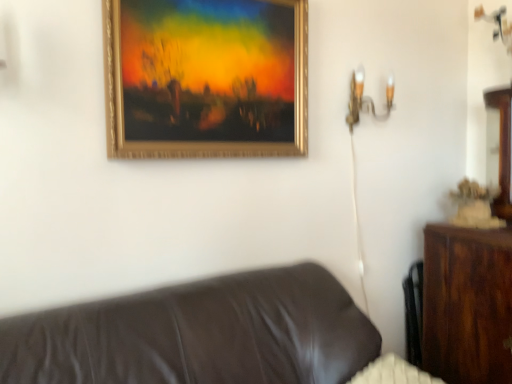
The height and width of the screenshot is (384, 512). I want to click on gold metallic picture frame at upper center, so click(206, 78).

Image resolution: width=512 pixels, height=384 pixels. Describe the element at coordinates (206, 78) in the screenshot. I see `gold metallic picture frame at upper center` at that location.

This screenshot has height=384, width=512. I want to click on brown leather couch at lower left, so click(x=199, y=334).

Is brown leather couch at lower left far from gold metallic picture frame at upper center?

No, brown leather couch at lower left is not far away from gold metallic picture frame at upper center.

How different are the orientations of brown leather couch at lower left and gold metallic picture frame at upper center in degrees?

0.402 degrees separate the facing orientations of brown leather couch at lower left and gold metallic picture frame at upper center.

Who is bigger, brown leather couch at lower left or gold metallic picture frame at upper center?

brown leather couch at lower left.

Which object is further away from the camera, brown leather couch at lower left or gold metallic picture frame at upper center?

gold metallic picture frame at upper center is further from the camera.

From the image's perspective, which one is positioned higher, gold metallic wall sconce at upper right or gold metallic picture frame at upper center?

gold metallic picture frame at upper center, from the image's perspective.

From a real-world perspective, is gold metallic wall sconce at upper right located higher than gold metallic picture frame at upper center?

Actually, gold metallic wall sconce at upper right is physically below gold metallic picture frame at upper center in the real world.

Can you confirm if gold metallic wall sconce at upper right is positioned to the left of gold metallic picture frame at upper center?

No, gold metallic wall sconce at upper right is not to the left of gold metallic picture frame at upper center.

Is gold metallic wall sconce at upper right touching gold metallic picture frame at upper center?

No, gold metallic wall sconce at upper right is not with gold metallic picture frame at upper center.

Considering the positions of objects gold metallic wall sconce at upper right and brown leather couch at lower left in the image provided, who is more to the left, gold metallic wall sconce at upper right or brown leather couch at lower left?

brown leather couch at lower left.

Does gold metallic wall sconce at upper right have a larger size compared to brown leather couch at lower left?

Incorrect, gold metallic wall sconce at upper right is not larger than brown leather couch at lower left.

From the image's perspective, is gold metallic wall sconce at upper right on brown leather couch at lower left?

Yes.

Is gold metallic wall sconce at upper right in front of or behind brown leather couch at lower left in the image?

gold metallic wall sconce at upper right is behind brown leather couch at lower left.

Considering the sizes of gold metallic picture frame at upper center and brown leather couch at lower left in the image, is gold metallic picture frame at upper center bigger or smaller than brown leather couch at lower left?

In the image, gold metallic picture frame at upper center appears to be smaller than brown leather couch at lower left.

Can you see gold metallic picture frame at upper center touching brown leather couch at lower left?

No, gold metallic picture frame at upper center is not beside brown leather couch at lower left.

Between gold metallic picture frame at upper center and brown leather couch at lower left, which one has smaller width?

gold metallic picture frame at upper center is thinner.

Which is correct: gold metallic picture frame at upper center is inside brown leather couch at lower left, or outside of it?

gold metallic picture frame at upper center is spatially situated outside brown leather couch at lower left.

Considering the sizes of objects brown leather couch at lower left and gold metallic wall sconce at upper right in the image provided, who is bigger, brown leather couch at lower left or gold metallic wall sconce at upper right?

brown leather couch at lower left.

What's the angular difference between brown leather couch at lower left and gold metallic wall sconce at upper right's facing directions?

The angle between the facing direction of brown leather couch at lower left and the facing direction of gold metallic wall sconce at upper right is 0.0331 degrees.

Does brown leather couch at lower left contain gold metallic wall sconce at upper right?

No, gold metallic wall sconce at upper right is not surrounded by brown leather couch at lower left.

Looking at their sizes, would you say brown leather couch at lower left is wider or thinner than gold metallic wall sconce at upper right?

Considering their sizes, brown leather couch at lower left looks broader than gold metallic wall sconce at upper right.

Is point (163, 17) positioned in front of point (387, 103)?

Yes, point (163, 17) is closer to viewer.

Is gold metallic picture frame at upper center bigger or smaller than gold metallic wall sconce at upper right?

In the image, gold metallic picture frame at upper center appears to be larger than gold metallic wall sconce at upper right.

Is gold metallic picture frame at upper center far from gold metallic wall sconce at upper right?

Actually, gold metallic picture frame at upper center and gold metallic wall sconce at upper right are a little close together.

Is gold metallic wall sconce at upper right at the back of gold metallic picture frame at upper center?

gold metallic picture frame at upper center is not turned away from gold metallic wall sconce at upper right.

Where is `studio couch on the right of gold metallic picture frame at upper center`? studio couch on the right of gold metallic picture frame at upper center is located at coordinates (199, 334).

The image size is (512, 384). I want to click on picture frame to the left of gold metallic wall sconce at upper right, so click(206, 78).

Considering their positions, is gold metallic wall sconce at upper right positioned closer to gold metallic picture frame at upper center than brown leather couch at lower left?

gold metallic wall sconce at upper right.

Based on their spatial positions, is gold metallic wall sconce at upper right or gold metallic picture frame at upper center closer to brown leather couch at lower left?

The object closer to brown leather couch at lower left is gold metallic picture frame at upper center.

Considering their positions, is brown leather couch at lower left positioned further to gold metallic picture frame at upper center than gold metallic wall sconce at upper right?

brown leather couch at lower left is further to gold metallic picture frame at upper center.

When comparing their distances from gold metallic wall sconce at upper right, does brown leather couch at lower left or gold metallic picture frame at upper center seem further?

brown leather couch at lower left.

Which object lies further to the anchor point brown leather couch at lower left, gold metallic picture frame at upper center or gold metallic wall sconce at upper right?

gold metallic wall sconce at upper right is further to brown leather couch at lower left.

When comparing their distances from gold metallic wall sconce at upper right, does gold metallic picture frame at upper center or brown leather couch at lower left seem further?

brown leather couch at lower left lies further to gold metallic wall sconce at upper right than the other object.

In order to click on picture frame located between brown leather couch at lower left and gold metallic wall sconce at upper right in the depth direction in this screenshot , I will do `click(206, 78)`.